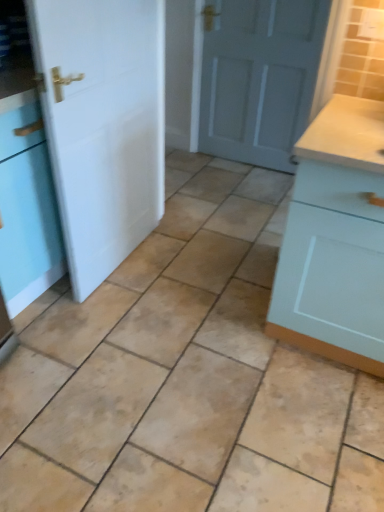
The image size is (384, 512). Find the location of `free space above light blue wood cabinet at right (from a real-world perspective)`. free space above light blue wood cabinet at right (from a real-world perspective) is located at coordinates (357, 126).